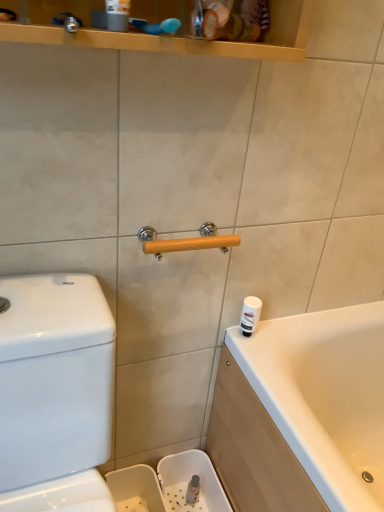
Question: Can you confirm if white plastic container at right is shorter than wooden at center?

Choices:
 (A) no
 (B) yes

Answer: (A)

Question: Does white plastic container at right turn towards wooden at center?

Choices:
 (A) no
 (B) yes

Answer: (A)

Question: Can you confirm if white plastic container at right is bigger than wooden at center?

Choices:
 (A) no
 (B) yes

Answer: (A)

Question: From a real-world perspective, is white plastic container at right physically below wooden at center?

Choices:
 (A) yes
 (B) no

Answer: (A)

Question: Is white plastic container at right next to wooden at center and touching it?

Choices:
 (A) no
 (B) yes

Answer: (A)

Question: Considering the positions of white glossy water tank at left and white plastic container at right in the image, is white glossy water tank at left wider or thinner than white plastic container at right?

Choices:
 (A) thin
 (B) wide

Answer: (B)

Question: From the image's perspective, is white glossy water tank at left located above or below white plastic container at right?

Choices:
 (A) below
 (B) above

Answer: (A)

Question: Relative to white plastic container at right, is white glossy water tank at left in front or behind?

Choices:
 (A) behind
 (B) front

Answer: (B)

Question: Is white glossy water tank at left taller or shorter than white plastic container at right?

Choices:
 (A) short
 (B) tall

Answer: (B)

Question: From the image's perspective, is white plastic container at right located above or below wooden at center?

Choices:
 (A) above
 (B) below

Answer: (B)

Question: Considering the positions of white plastic container at right and wooden at center in the image, is white plastic container at right bigger or smaller than wooden at center?

Choices:
 (A) big
 (B) small

Answer: (B)

Question: Is white plastic container at right in front of or behind wooden at center in the image?

Choices:
 (A) behind
 (B) front

Answer: (A)

Question: Is point (254, 297) positioned closer to the camera than point (157, 243)?

Choices:
 (A) closer
 (B) farther

Answer: (B)

Question: Is point (105, 360) closer or farther from the camera than point (165, 240)?

Choices:
 (A) farther
 (B) closer

Answer: (B)

Question: Is white glossy water tank at left in front of or behind wooden at center in the image?

Choices:
 (A) behind
 (B) front

Answer: (B)